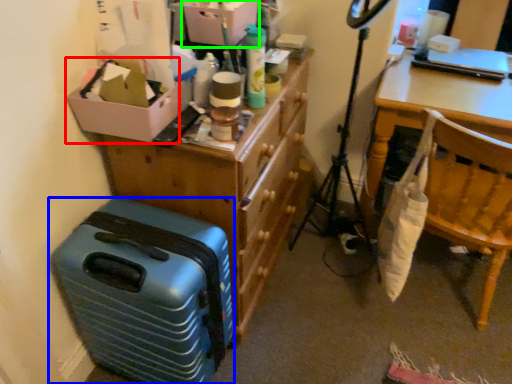
Question: Based on their relative distances, which object is farther from box (highlighted by a red box)? Choose from suitcase (highlighted by a blue box) and storage box (highlighted by a green box).

Choices:
 (A) suitcase
 (B) storage box

Answer: (A)